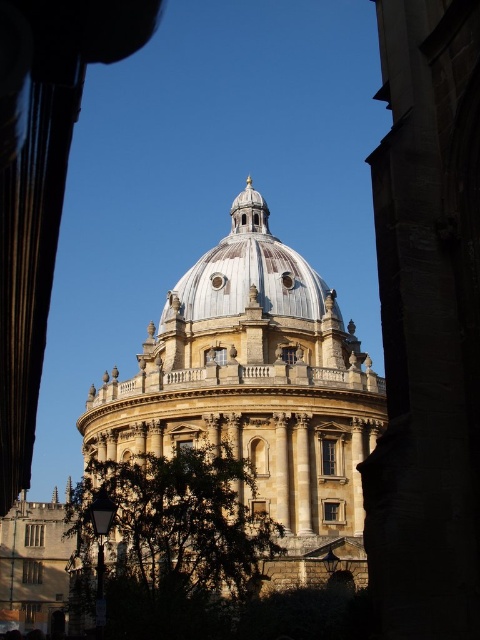
You are standing in front of the grand structure and want to take a photo. There are two points marked on the dome, one at coordinates point (x=226, y=289) and the other at point (x=310, y=276). Which point will appear closer to the center of your camera view?

Point (x=226, y=289) is closer to the camera than point (x=310, y=276), so it will appear closer to the center of your camera view.

You are standing in front of the grand structure and want to take a photo of the golden stone dome at center and the green leafy tree at lower left. Which object should you position to the right side of your camera frame?

You should position the golden stone dome at center to the right side of your camera frame because it is already located to the right of the green leafy tree at lower left.